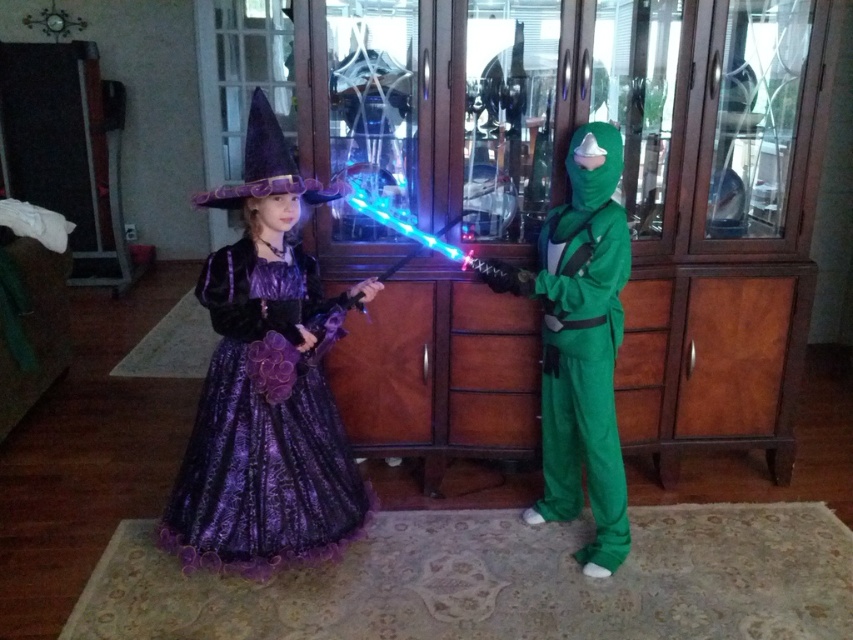
You are a photographer trying to capture the shiny purple dress at center and the purple satin witch hat at upper center in a single shot. Which object should you focus on first if you want to ensure both are in focus?

The shiny purple dress at center is taller than the purple satin witch hat at upper center, so focusing on the taller object first will help ensure both are in focus.

You are a photographer trying to capture the shiny purple dress at center and the purple satin witch hat at upper center in a single frame. Since the camera can only focus on one object at a time, which object should you focus on first to ensure the other remains in the background?

The shiny purple dress at center is below the purple satin witch hat at upper center, so you should focus on the purple satin witch hat at upper center first. This way, the shiny purple dress at center will naturally appear in the lower part of the frame as the background.